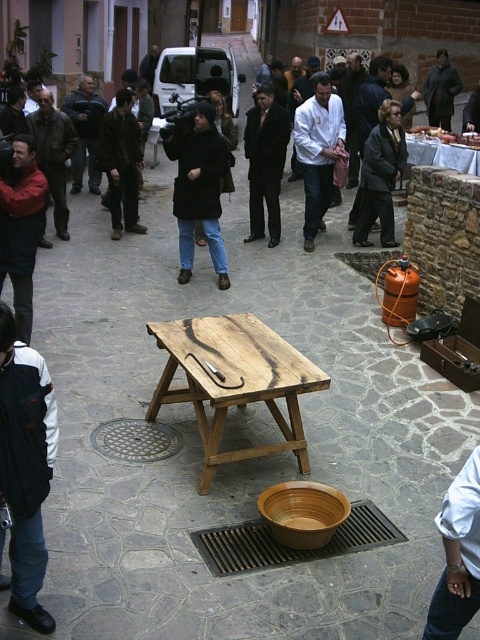
Which is more to the right, white cotton shirt at center or dark gray jacket at center?

Positioned to the right is white cotton shirt at center.

Between point (312, 209) and point (72, 104), which one is positioned in front?

Point (312, 209) is more forward.

Locate an element on the screen. Image resolution: width=480 pixels, height=640 pixels. white cotton shirt at center is located at coordinates (317, 150).

From the picture: Is wooden picnic table at center to the right of brown matte bowl at center from the viewer's perspective?

In fact, wooden picnic table at center is to the left of brown matte bowl at center.

Is point (192, 380) positioned in front of point (276, 493)?

No.

Who is more forward, (240, 349) or (264, 497)?

Point (264, 497) is more forward.

At what (x,y) coordinates should I click in order to perform the action: click on wooden picnic table at center. Please return your answer as a coordinate pair (x, y). Looking at the image, I should click on (233, 381).

Is the position of black fuzzy coat at center less distant than that of white glossy table at center?

Yes, black fuzzy coat at center is closer to the viewer.

The image size is (480, 640). What do you see at coordinates (199, 188) in the screenshot?
I see `black fuzzy coat at center` at bounding box center [199, 188].

Is point (193, 124) more distant than point (428, 141)?

That is False.

Find the location of a particular element. black fuzzy coat at center is located at coordinates (199, 188).